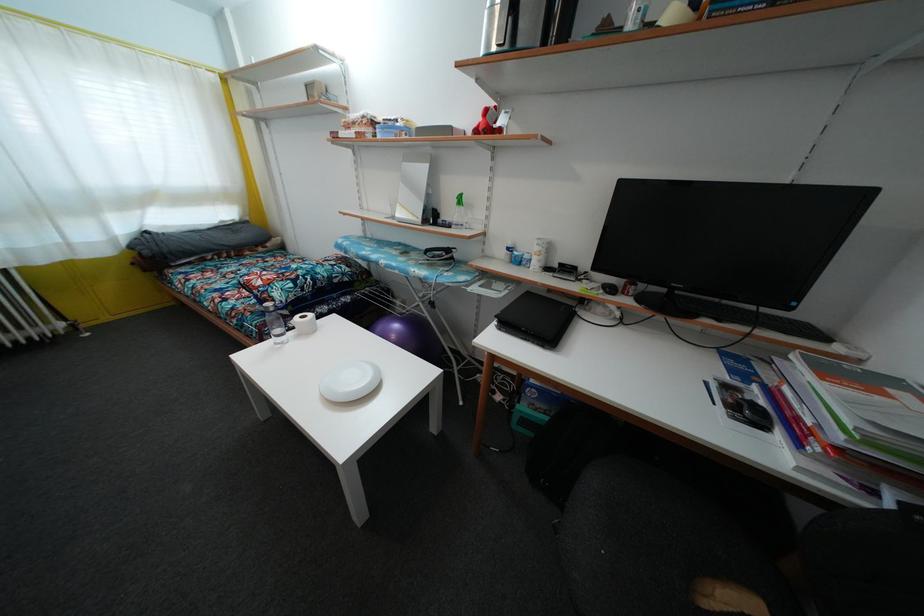
The location [409,334] corresponds to which object?

This point indicates the purple exercise ball.